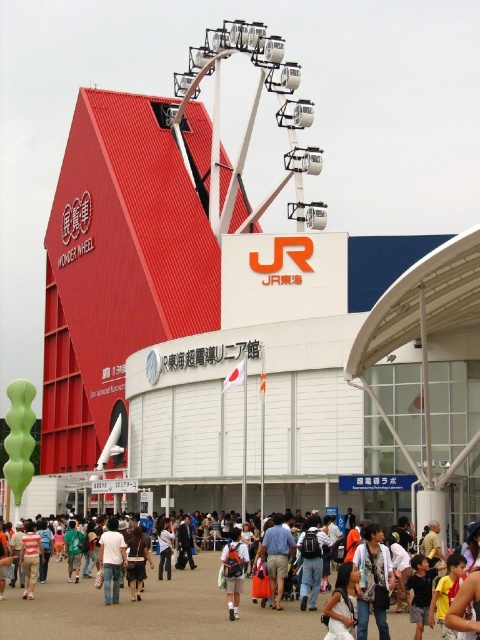
Question: Which of these objects is positioned closest to the blue denim shorts at center?

Choices:
 (A) white school uniform at center
 (B) white cotton shirt at center

Answer: (A)

Question: Does white cotton shirt at center appear over white school uniform at center?

Choices:
 (A) yes
 (B) no

Answer: (B)

Question: Is white cotton shirt at center to the left of blue denim shorts at center from the viewer's perspective?

Choices:
 (A) yes
 (B) no

Answer: (A)

Question: Which is farther from the white matte shirt at center?

Choices:
 (A) white school uniform at center
 (B) light brown backpack at center
 (C) blue denim shorts at center

Answer: (B)

Question: Estimate the real-world distances between objects in this image. Which object is farther from the light brown backpack at center?

Choices:
 (A) white school uniform at center
 (B) white matte shirt at center
 (C) white cotton shirt at center
 (D) blue denim shorts at center

Answer: (C)

Question: Does blue denim shorts at center appear on the right side of white matte shirt at center?

Choices:
 (A) no
 (B) yes

Answer: (B)